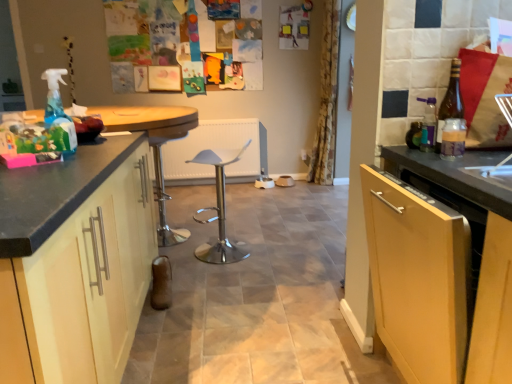
In order to click on vacant region to the right of polished silver bar stool at center, positioned as the 1th bar stool in right-to-left order in this screenshot , I will do `click(272, 252)`.